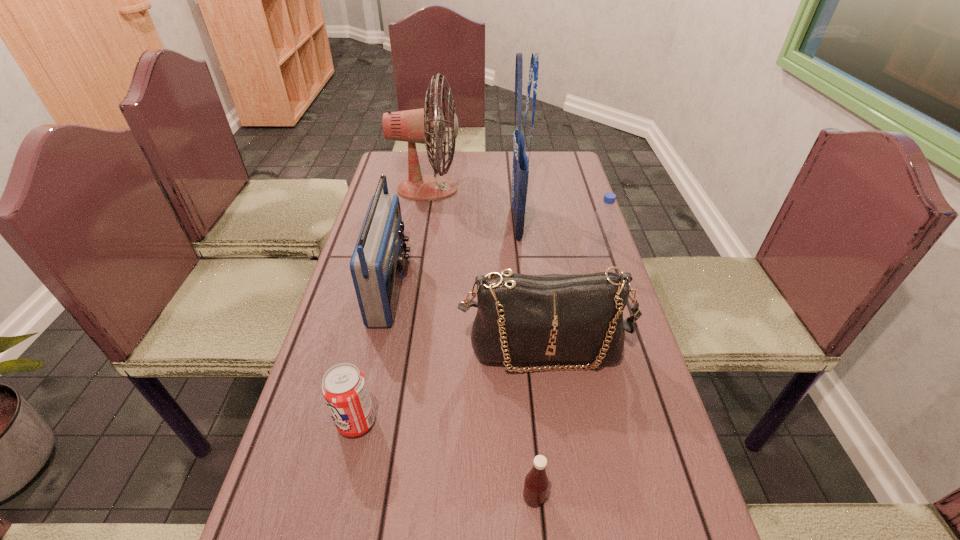
You are a GUI agent. You are given a task and a screenshot of the screen. Output one action in this format:
    pyautogui.click(x=<x>, y=<y>)
    Task: Click on the shopping bag
    Image resolution: width=960 pixels, height=540 pixels.
    Given the screenshot: What is the action you would take?
    pyautogui.click(x=520, y=174)

Find the location of a particular element. The image size is (960, 540). fan is located at coordinates (414, 126).

Locate an element on the screen. This screenshot has height=540, width=960. radio receiver is located at coordinates (377, 263).

I want to click on handbag, so click(x=521, y=318).

This screenshot has width=960, height=540. I want to click on bottle, so click(x=599, y=244).

This screenshot has height=540, width=960. In order to click on the sixth farthest object in this screenshot , I will do `click(344, 388)`.

Find the location of a particular element. the nearest object is located at coordinates (536, 482).

Locate an element on the screen. The height and width of the screenshot is (540, 960). free space located on the front-facing side of the shopping bag is located at coordinates (404, 222).

Where is `vacant region located on the front-facing side of the shopping bag`? This screenshot has width=960, height=540. vacant region located on the front-facing side of the shopping bag is located at coordinates (443, 222).

Image resolution: width=960 pixels, height=540 pixels. Find the location of `blank space located 0.090m on the front-facing side of the shopping bag`. blank space located 0.090m on the front-facing side of the shopping bag is located at coordinates (480, 222).